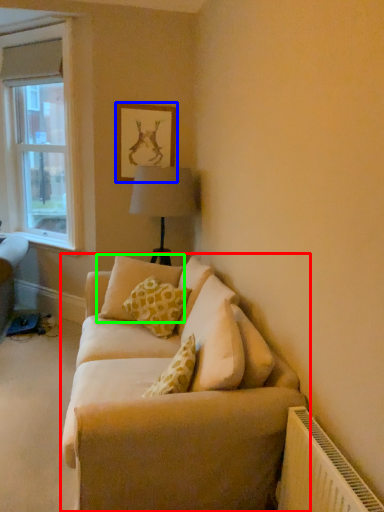
Question: Which object is the farthest from studio couch (highlighted by a red box)? Choose among these: picture frame (highlighted by a blue box) or pillow (highlighted by a green box).

Choices:
 (A) picture frame
 (B) pillow

Answer: (A)